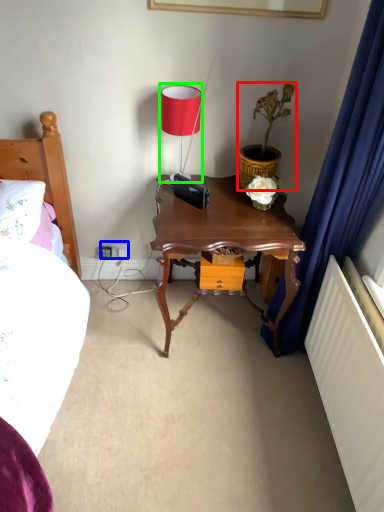
Question: Considering the real-world distances, which object is farthest from houseplant (highlighted by a red box)? electric outlet (highlighted by a blue box) or table lamp (highlighted by a green box)?

Choices:
 (A) electric outlet
 (B) table lamp

Answer: (A)